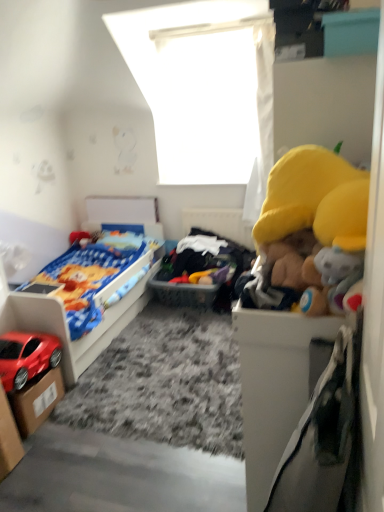
Question: Would you say soft plush toys at center is to the left or to the right of cardboard box at lower left, the 2th storage box positioned from the front, in the picture?

Choices:
 (A) right
 (B) left

Answer: (A)

Question: In terms of height, does soft plush toys at center look taller or shorter compared to cardboard box at lower left, the 2th storage box positioned from the front?

Choices:
 (A) short
 (B) tall

Answer: (B)

Question: Based on their relative distances, which object is farther from the soft plush toys at center?

Choices:
 (A) matte plastic bed at left
 (B) cardboard box at lower left, the 2th storage box positioned from the front
 (C) cardboard box at lower left, which is the second storage box from back to front
 (D) shiny red car at lower left
 (E) white fabric at upper center

Answer: (C)

Question: Estimate the real-world distances between objects in this image. Which object is closer to the shiny red car at lower left?

Choices:
 (A) matte plastic bed at left
 (B) white fabric at upper center
 (C) cardboard box at lower left, the 1th storage box when ordered from back to front
 (D) cardboard box at lower left, which is the second storage box from back to front
 (E) soft plush toys at center

Answer: (C)